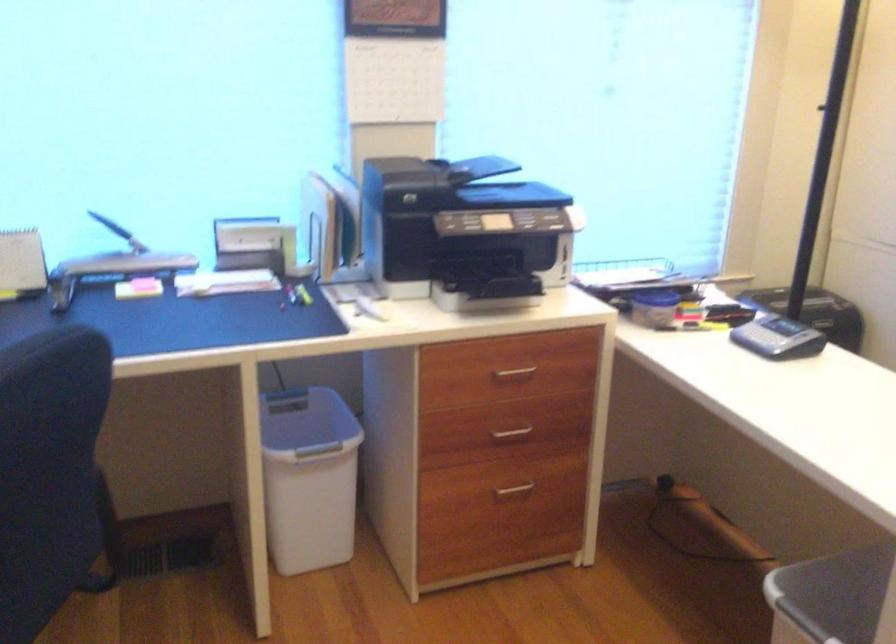
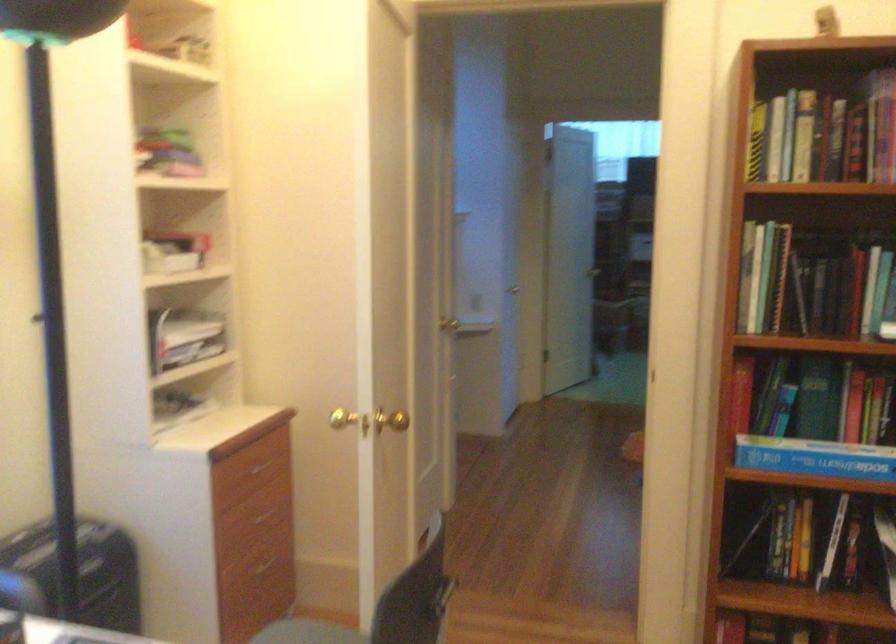
Question: The first image is from the beginning of the video and the second image is from the end. How did the camera likely rotate when shooting the video?

Choices:
 (A) Left
 (B) Right
 (C) Up
 (D) Down

Answer: (B)